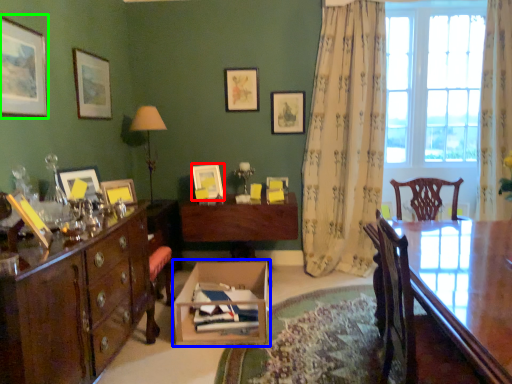
Question: Which object is positioned closest to picture frame (highlighted by a red box)? Select from cardboard box (highlighted by a blue box) and picture frame (highlighted by a green box).

Choices:
 (A) cardboard box
 (B) picture frame

Answer: (A)